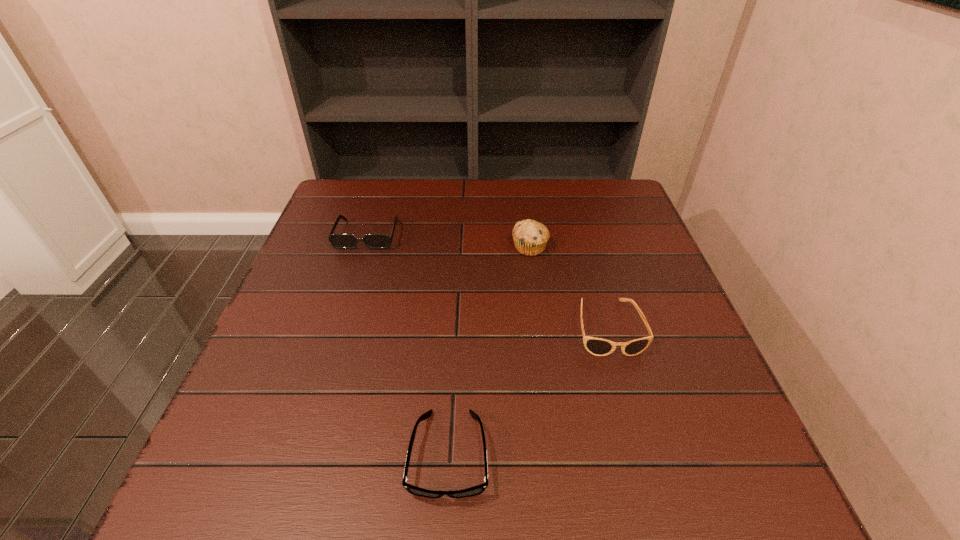
At what (x,y) coordinates should I click in order to perform the action: click on vacant space located on the front-facing side of the rightmost object. Please return your answer as a coordinate pair (x, y). The image size is (960, 540). Looking at the image, I should click on (623, 382).

Identify the location of object located at the far edge. (339, 241).

This screenshot has height=540, width=960. In order to click on object at the near edge in this screenshot , I will do `click(479, 489)`.

Find the location of a particular element. object present at the left edge is located at coordinates (339, 241).

At what (x,y) coordinates should I click in order to perform the action: click on object located in the right edge section of the desktop. Please return your answer as a coordinate pair (x, y). The height and width of the screenshot is (540, 960). Looking at the image, I should click on (597, 346).

I want to click on object at the far left corner, so click(x=339, y=241).

In the image, there is a desktop. At what (x,y) coordinates should I click in order to perform the action: click on vacant space at the far edge. Please return your answer as a coordinate pair (x, y). Image resolution: width=960 pixels, height=540 pixels. Looking at the image, I should click on (533, 205).

Locate an element on the screen. vacant space at the near edge of the desktop is located at coordinates (355, 486).

In the image, there is a desktop. Where is `free space at the left edge`? free space at the left edge is located at coordinates (335, 267).

Locate an element on the screen. Image resolution: width=960 pixels, height=540 pixels. free spot at the far left corner of the desktop is located at coordinates (371, 212).